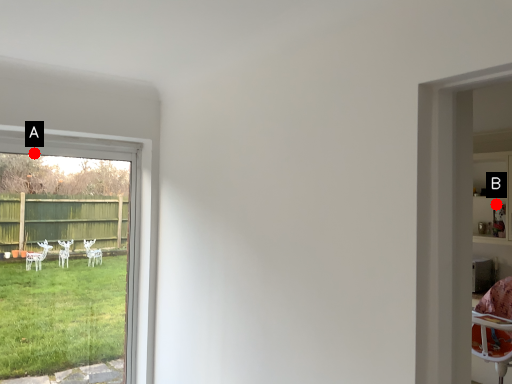
Question: Two points are circled on the image, labeled by A and B beside each circle. Which of the following is the closest to the observer?

Choices:
 (A) A is closer
 (B) B is closer

Answer: (A)